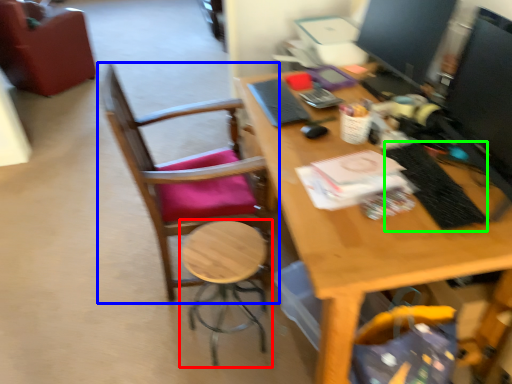
Question: Based on their relative distances, which object is farther from stool (highlighted by a red box)? Choose from chair (highlighted by a blue box) and laptop keyboard (highlighted by a green box).

Choices:
 (A) chair
 (B) laptop keyboard

Answer: (B)